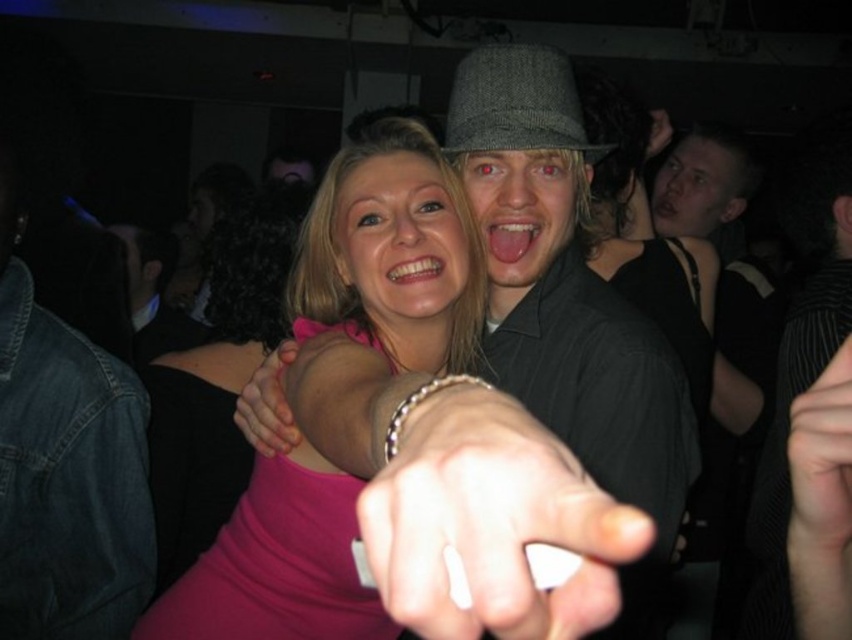
Does pink matte dress at center have a lesser height compared to gray woolen fedora at center?

Incorrect, pink matte dress at center's height does not fall short of gray woolen fedora at center's.

Which is more to the left, pink matte dress at center or gray woolen fedora at center?

From the viewer's perspective, pink matte dress at center appears more on the left side.

Which is behind, point (168, 355) or point (498, 147)?

The point (168, 355) is behind.

Find the location of a particular element. The height and width of the screenshot is (640, 852). pink matte dress at center is located at coordinates (217, 378).

Can you confirm if matte black face at upper right is taller than dark gray textured shirt at center?

Incorrect, matte black face at upper right's height is not larger of dark gray textured shirt at center's.

Between matte black face at upper right and dark gray textured shirt at center, which one has more height?

Standing taller between the two is dark gray textured shirt at center.

Identify the location of matte black face at upper right. (695, 188).

Who is higher up, pink matte dress at center or matte black face at upper right?

Positioned higher is matte black face at upper right.

Does point (242, 209) come behind point (678, 180)?

No, it is in front of (678, 180).

I want to click on pink matte dress at center, so click(x=217, y=378).

The height and width of the screenshot is (640, 852). What are the coordinates of `pink matte dress at center` in the screenshot? It's located at (217, 378).